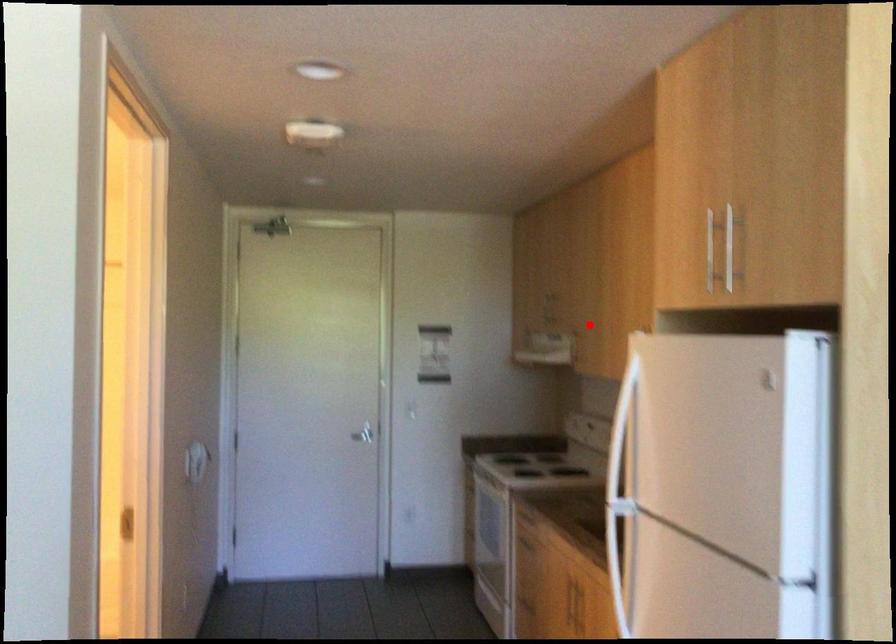
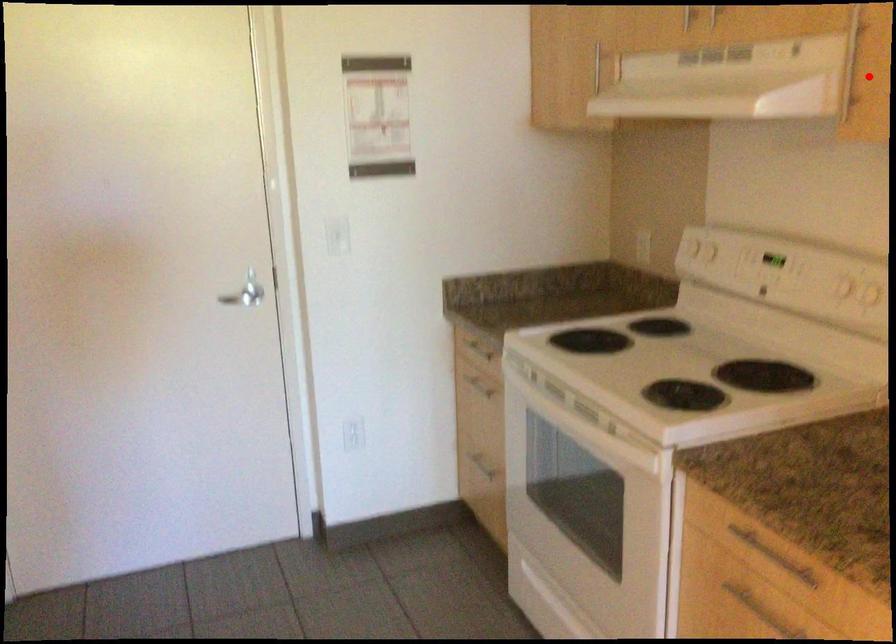
In the scene shown: I am providing you with two images of the same scene from different viewpoints. A red point is marked on the first image and another point is marked on the second image. Is the red point in image1 aligned with the point shown in image2?

Yes